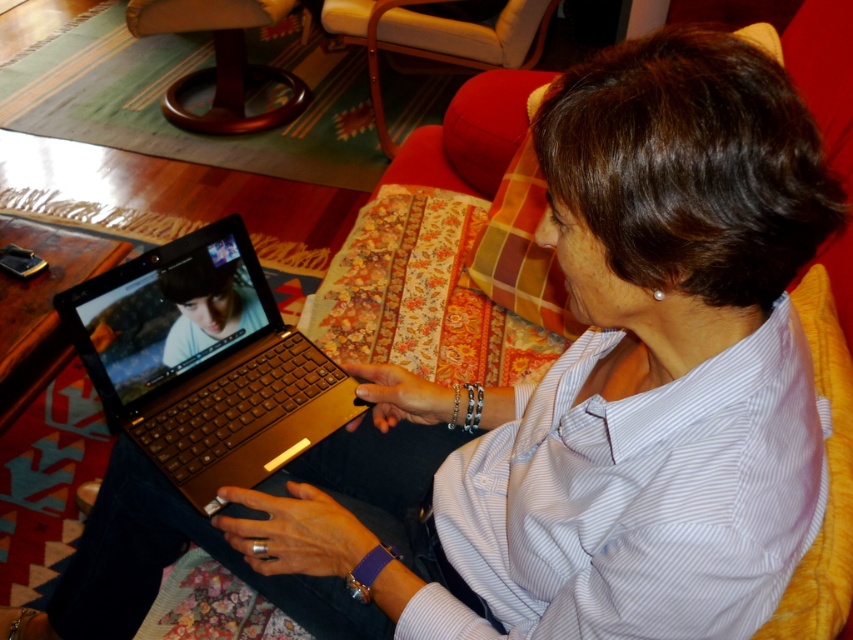
Question: Does red leather armchair at upper center appear on the left side of mahogany wood armchair at upper left?

Choices:
 (A) no
 (B) yes

Answer: (A)

Question: Is gold metallic laptop at center to the left of red leather armchair at upper center from the viewer's perspective?

Choices:
 (A) no
 (B) yes

Answer: (B)

Question: Among these objects, which one is farthest from the camera?

Choices:
 (A) mahogany wood armchair at upper left
 (B) red leather armchair at upper center
 (C) gold metallic laptop at center

Answer: (A)

Question: Which of the following is the farthest from the observer?

Choices:
 (A) (213, 17)
 (B) (543, 45)
 (C) (339, 419)

Answer: (B)

Question: Can you confirm if red leather armchair at upper center is thinner than mahogany wood armchair at upper left?

Choices:
 (A) yes
 (B) no

Answer: (B)

Question: Which of the following is the farthest from the observer?

Choices:
 (A) red leather armchair at upper center
 (B) gold metallic laptop at center

Answer: (A)